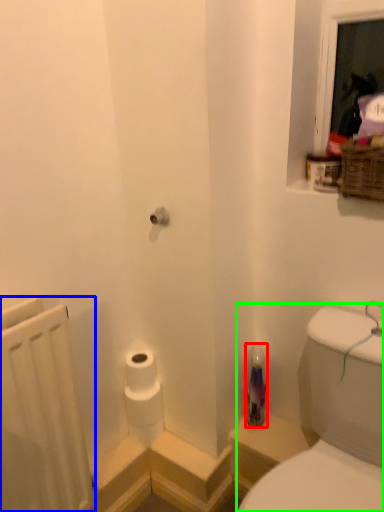
Question: Which is nearer to the bottle (highlighted by a red box)? radiator (highlighted by a blue box) or sink (highlighted by a green box).

Choices:
 (A) radiator
 (B) sink

Answer: (B)